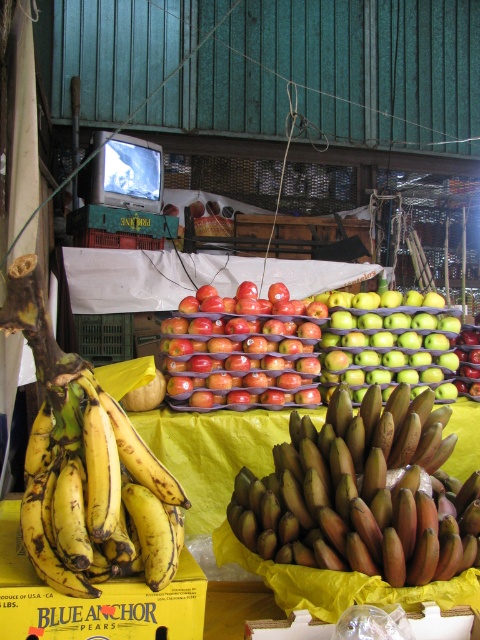
Which is more to the right, shiny red apples at center or green matte apples at center?

green matte apples at center is more to the right.

Is point (253, 342) farther from camera compared to point (383, 397)?

Yes, it is behind point (383, 397).

The height and width of the screenshot is (640, 480). What do you see at coordinates (240, 349) in the screenshot? I see `shiny red apples at center` at bounding box center [240, 349].

Image resolution: width=480 pixels, height=640 pixels. I want to click on shiny red apples at center, so click(240, 349).

Does point (73, 456) lie behind point (455, 324)?

No, it is in front of (455, 324).

Which is behind, point (59, 556) or point (373, 340)?

The point (373, 340) is more distant.

Measure the distance between yellow matte bananas at lower left and camera.

yellow matte bananas at lower left is 1.80 meters from camera.

Identify the location of yellow matte bananas at lower left. (97, 500).

Can you confirm if brown rough bananas at center is smaller than shiny red apples at center?

Actually, brown rough bananas at center might be larger than shiny red apples at center.

Can you confirm if brown rough bananas at center is shorter than shiny red apples at center?

Indeed, brown rough bananas at center has a lesser height compared to shiny red apples at center.

Is point (294, 522) farther from camera compared to point (245, 364)?

No, it is in front of (245, 364).

Locate an element on the screen. The height and width of the screenshot is (640, 480). brown rough bananas at center is located at coordinates pyautogui.click(x=352, y=492).